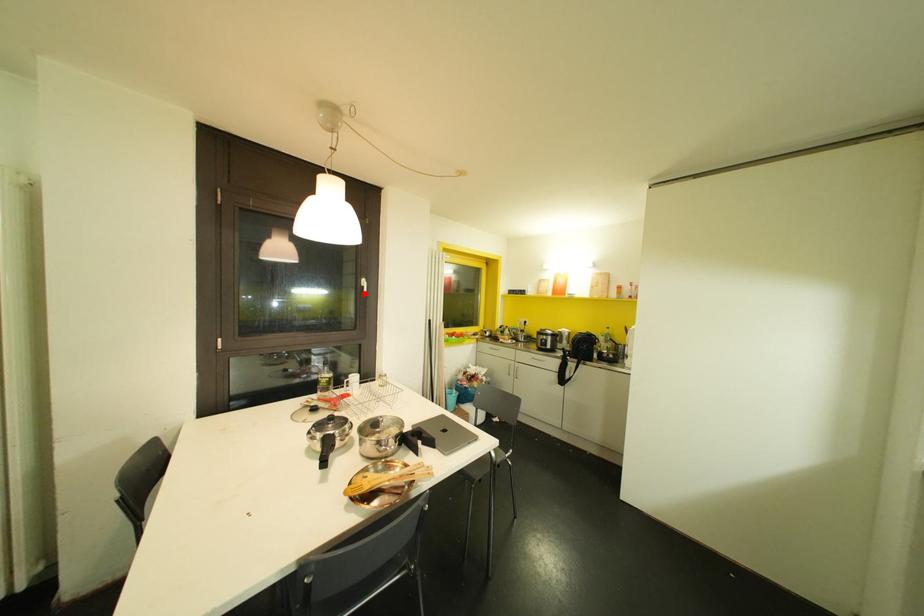
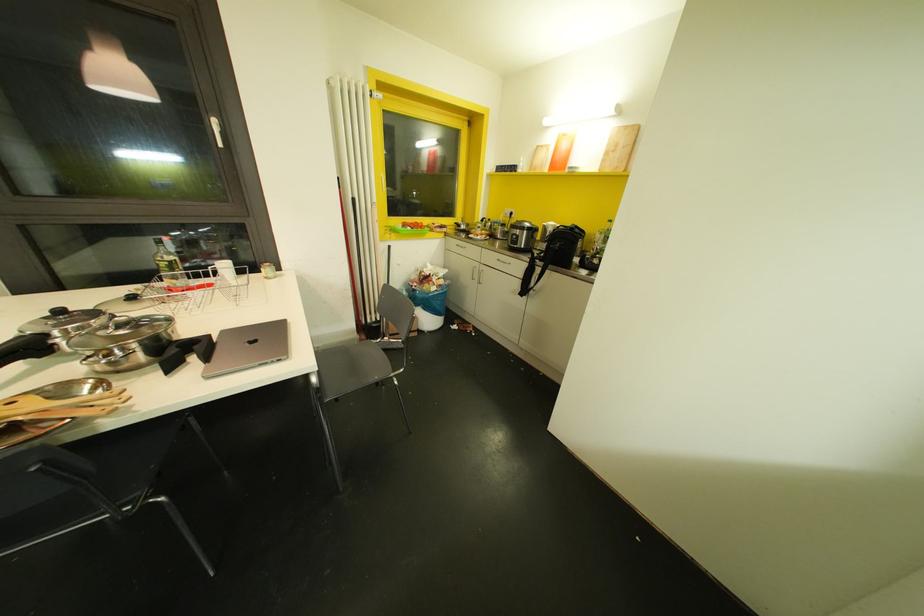
Locate, in the second image, the point that corresponds to the highlighted location in the first image.

(220, 145)